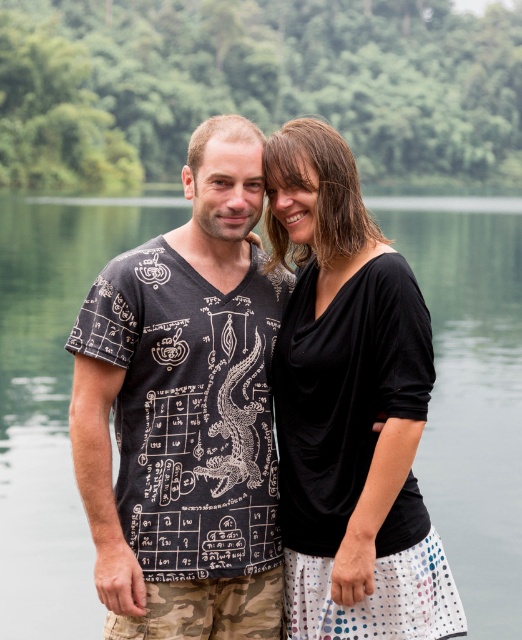
Consider the image. You are a photographer trying to capture the reflection of the man in the water. The point where you should focus your camera to capture his reflection is at coordinates point (471,390). Is this point located on the transparent water at center?

Yes, the point (471,390) is on the transparent water at center, so focusing there will capture the reflection.